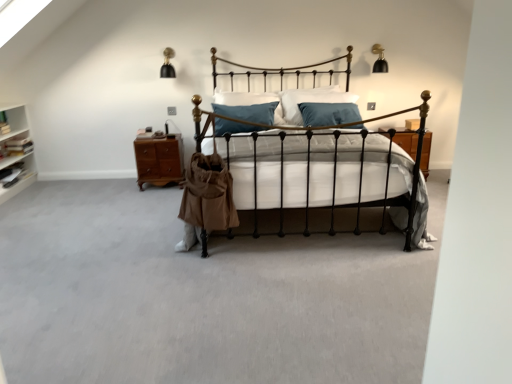
Where is `blue velvet pillow at center`? The image size is (512, 384). blue velvet pillow at center is located at coordinates (251, 101).

You are a GUI agent. You are given a task and a screenshot of the screen. Output one action in this format:
    pyautogui.click(x=<x>, y=<y>)
    Task: Click on the black wrought iron bed at center
    
    Given the screenshot: What is the action you would take?
    pyautogui.click(x=322, y=167)

This screenshot has width=512, height=384. Identify the location of blue velvet pillow at center. (251, 101).

Is blue velvet pillow at center to the left or to the right of black wrought iron bed at center in the image?

blue velvet pillow at center is to the left of black wrought iron bed at center.

Considering the sizes of objects blue velvet pillow at center and black wrought iron bed at center in the image provided, who is smaller, blue velvet pillow at center or black wrought iron bed at center?

blue velvet pillow at center is smaller.

Between blue velvet pillow at center and black wrought iron bed at center, which one has more height?

Standing taller between the two is black wrought iron bed at center.

Locate an element on the screen. The height and width of the screenshot is (384, 512). bed lying below the blue velvet pillow at center (from the image's perspective) is located at coordinates (322, 167).

From the image's perspective, would you say black wrought iron bed at center is positioned over blue velvet pillow at center?

Actually, black wrought iron bed at center appears below blue velvet pillow at center in the image.

Is black wrought iron bed at center at the left side of blue velvet pillow at center?

Incorrect, black wrought iron bed at center is not on the left side of blue velvet pillow at center.

Considering the relative sizes of black wrought iron bed at center and blue velvet pillow at center in the image provided, is black wrought iron bed at center thinner than blue velvet pillow at center?

No, black wrought iron bed at center is not thinner than blue velvet pillow at center.

Where is `nightstand directly beneath the blue velvet pillow at center (from a real-world perspective)`? The width and height of the screenshot is (512, 384). nightstand directly beneath the blue velvet pillow at center (from a real-world perspective) is located at coordinates (159, 160).

Would you consider blue velvet pillow at center to be distant from brown wood nightstand at left?

No, blue velvet pillow at center is in close proximity to brown wood nightstand at left.

Can brown wood nightstand at left be found inside blue velvet pillow at center?

No, brown wood nightstand at left is located outside of blue velvet pillow at center.

How many degrees apart are the facing directions of blue velvet pillow at center and brown wood nightstand at left?

The angular difference between blue velvet pillow at center and brown wood nightstand at left is 2.22 degrees.

In the scene shown: Would you say brown wood nightstand at left is outside black wrought iron bed at center?

brown wood nightstand at left lies outside black wrought iron bed at center's area.

Can you tell me how much brown wood nightstand at left and black wrought iron bed at center differ in facing direction?

The angular difference between brown wood nightstand at left and black wrought iron bed at center is 6.59 degrees.

Between brown wood nightstand at left and black wrought iron bed at center, which one has more height?

With more height is black wrought iron bed at center.

Are brown wood nightstand at left and black wrought iron bed at center far apart?

Yes.

Looking at this image, measure the distance from brown wood nightstand at left to blue velvet pillow at center.

brown wood nightstand at left is 32.35 inches from blue velvet pillow at center.

Is brown wood nightstand at left positioned far away from blue velvet pillow at center?

brown wood nightstand at left is near blue velvet pillow at center, not far away.

Find the location of a particular element. The height and width of the screenshot is (384, 512). nightstand lying on the left of blue velvet pillow at center is located at coordinates (159, 160).

Can you confirm if brown wood nightstand at left is shorter than blue velvet pillow at center?

No, brown wood nightstand at left is not shorter than blue velvet pillow at center.

From a real-world perspective, which object rests below the other?

brown wood nightstand at left is physically lower.

How different are the orientations of black wrought iron bed at center and brown wood nightstand at left in degrees?

6.59 degrees separate the facing orientations of black wrought iron bed at center and brown wood nightstand at left.

Relative to brown wood nightstand at left, is black wrought iron bed at center in front or behind?

Visually, black wrought iron bed at center is located in front of brown wood nightstand at left.

The height and width of the screenshot is (384, 512). Identify the location of bed on the right of blue velvet pillow at center. (322, 167).

Locate an element on the screen. This screenshot has height=384, width=512. bed beneath the blue velvet pillow at center (from a real-world perspective) is located at coordinates (322, 167).

Considering their positions, is blue velvet pillow at center positioned closer to black wrought iron bed at center than brown wood nightstand at left?

brown wood nightstand at left lies closer to black wrought iron bed at center than the other object.

Based on the photo, considering their positions, is brown wood nightstand at left positioned further to black wrought iron bed at center than blue velvet pillow at center?

blue velvet pillow at center.

Based on their spatial positions, is blue velvet pillow at center or black wrought iron bed at center closer to brown wood nightstand at left?

Among the two, blue velvet pillow at center is located nearer to brown wood nightstand at left.

Based on their spatial positions, is brown wood nightstand at left or black wrought iron bed at center closer to blue velvet pillow at center?

Among the two, brown wood nightstand at left is located nearer to blue velvet pillow at center.

Estimate the real-world distances between objects in this image. Which object is further from brown wood nightstand at left, black wrought iron bed at center or blue velvet pillow at center?

black wrought iron bed at center.

From the image, which object appears to be nearer to blue velvet pillow at center, black wrought iron bed at center or brown wood nightstand at left?

brown wood nightstand at left.

Image resolution: width=512 pixels, height=384 pixels. I want to click on pillow between black wrought iron bed at center and brown wood nightstand at left in the front-back direction, so coord(251,101).